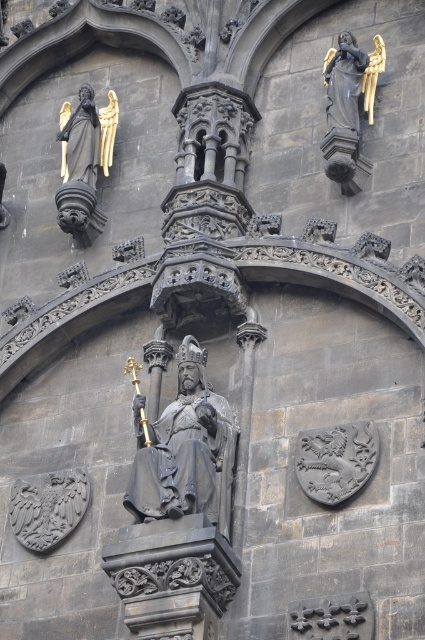
Question: Can you confirm if polished bronze statue at center is smaller than gold leaf statue at upper left?

Choices:
 (A) no
 (B) yes

Answer: (A)

Question: Is polished bronze statue at center thinner than gold leaf statue at upper left?

Choices:
 (A) yes
 (B) no

Answer: (B)

Question: Among these objects, which one is nearest to the camera?

Choices:
 (A) gold leaf statue at upper left
 (B) polished bronze statue at center

Answer: (B)

Question: Which object appears farthest from the camera in this image?

Choices:
 (A) polished bronze statue at center
 (B) gold leaf statue at upper left

Answer: (B)

Question: Can you confirm if polished bronze statue at center is thinner than gold leaf statue at upper left?

Choices:
 (A) yes
 (B) no

Answer: (B)